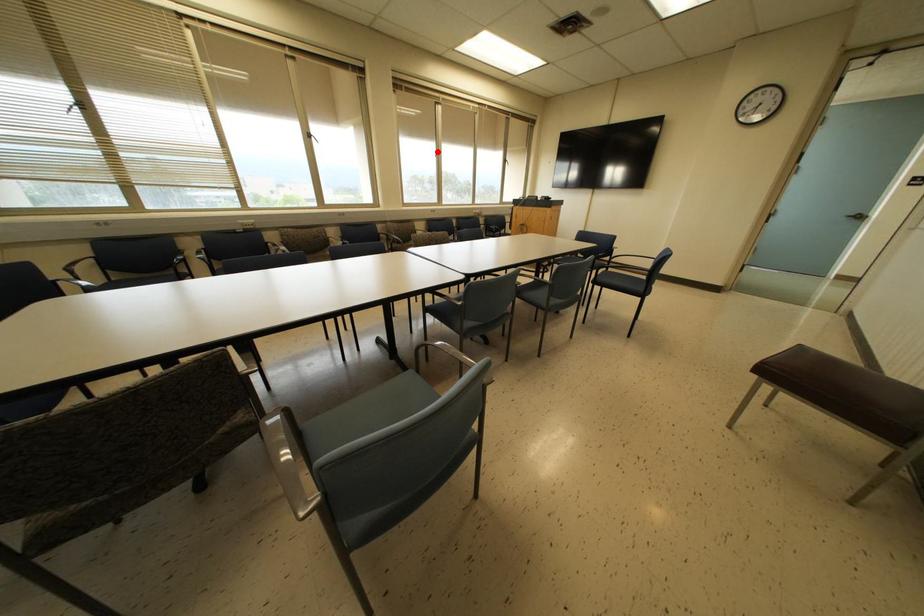
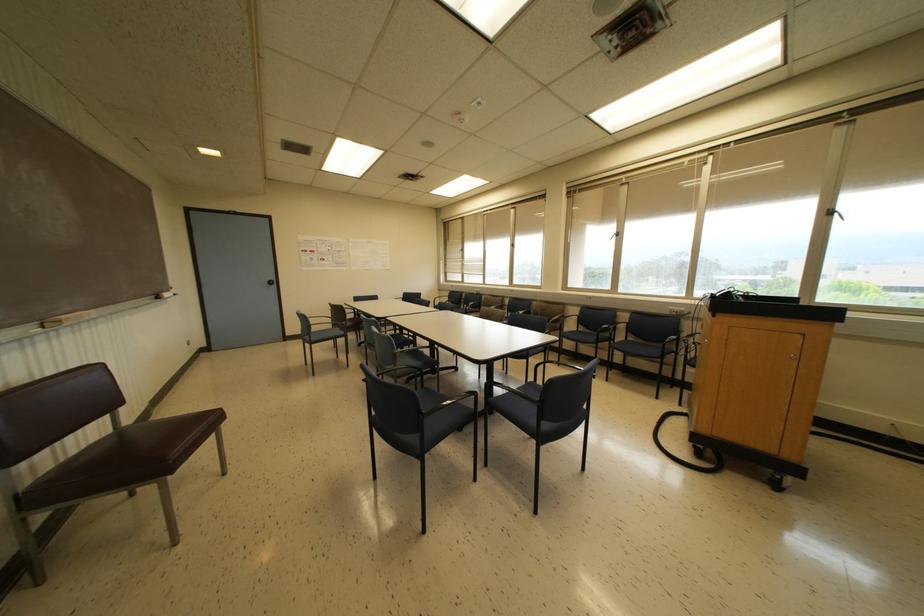
Find the pixel in the second image that matches the highlighted location in the first image.

(617, 233)